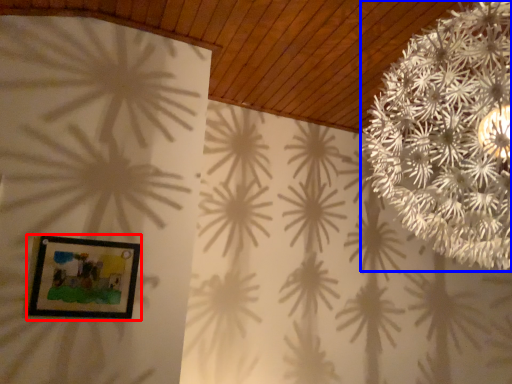
Question: Which object appears closest to the camera in this image, picture frame (highlighted by a red box) or flower (highlighted by a blue box)?

Choices:
 (A) picture frame
 (B) flower

Answer: (B)